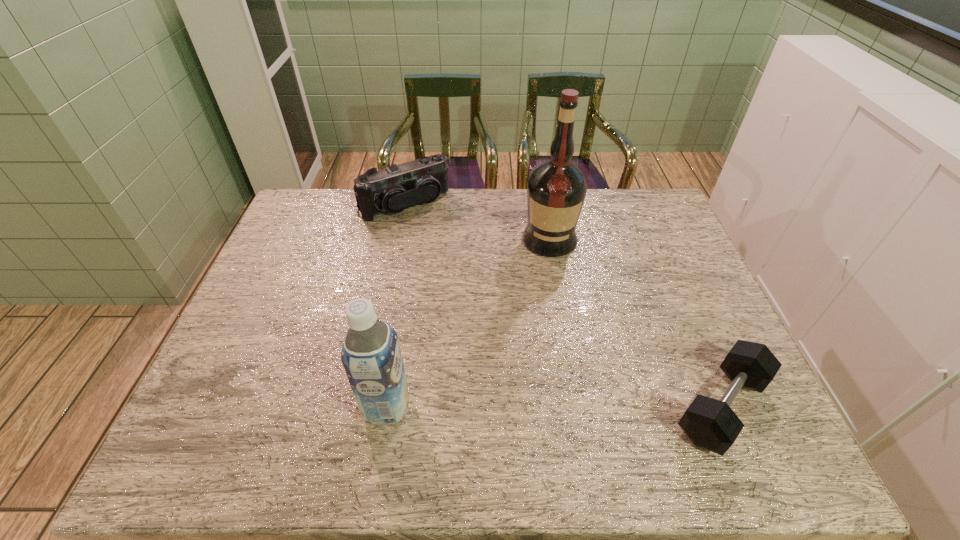
Identify the location of soya milk. (371, 356).

Find the location of a particular element. the rightmost object is located at coordinates (711, 424).

The height and width of the screenshot is (540, 960). I want to click on dumbbell, so click(711, 424).

The width and height of the screenshot is (960, 540). What are the coordinates of `liquor` in the screenshot? It's located at (556, 190).

Find the location of a particular element. This screenshot has width=960, height=540. the second object from right to left is located at coordinates (556, 190).

At what (x,y) coordinates should I click in order to perform the action: click on camcorder. Please return your answer as a coordinate pair (x, y). This screenshot has height=540, width=960. Looking at the image, I should click on (390, 190).

This screenshot has width=960, height=540. Find the location of `vacant space situated 0.390m on the label of the second tallest object`. vacant space situated 0.390m on the label of the second tallest object is located at coordinates (195, 407).

What are the coordinates of `free space located 0.060m on the label of the second tallest object` in the screenshot? It's located at (339, 407).

In order to click on vacant space situated 0.220m on the label of the second tallest object in this screenshot , I will do [269, 407].

I want to click on vacant space located on the back of the dumbbell, so click(661, 265).